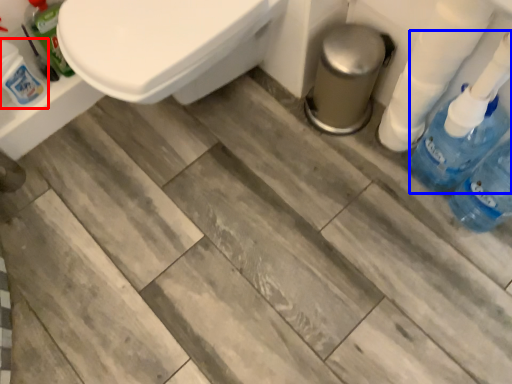
Question: Which object is further to the camera taking this photo, cleaning product (highlighted by a red box) or cleaning product (highlighted by a blue box)?

Choices:
 (A) cleaning product
 (B) cleaning product

Answer: (A)